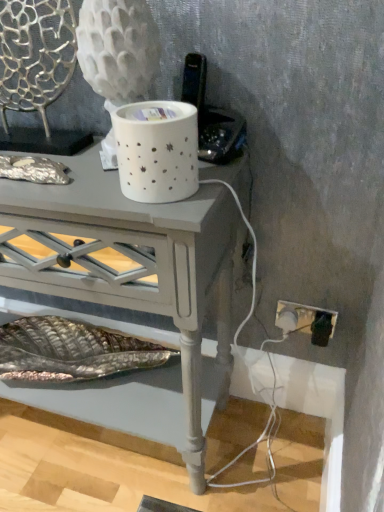
Question: Is point (39, 2) positioned closer to the camera than point (122, 206)?

Choices:
 (A) farther
 (B) closer

Answer: (A)

Question: Is metallic silver swivel chair at upper left inside the boundaries of matte gray table at center, or outside?

Choices:
 (A) inside
 (B) outside

Answer: (B)

Question: In terms of size, does metallic silver swivel chair at upper left appear bigger or smaller than matte gray table at center?

Choices:
 (A) big
 (B) small

Answer: (B)

Question: Does point (82, 226) appear closer or farther from the camera than point (6, 0)?

Choices:
 (A) farther
 (B) closer

Answer: (B)

Question: From the image's perspective, relative to metallic silver swivel chair at upper left, is matte gray table at center above or below?

Choices:
 (A) above
 (B) below

Answer: (B)

Question: Is matte gray table at center to the left or to the right of metallic silver swivel chair at upper left in the image?

Choices:
 (A) left
 (B) right

Answer: (B)

Question: From a real-world perspective, is matte gray table at center above or below metallic silver swivel chair at upper left?

Choices:
 (A) above
 (B) below

Answer: (B)